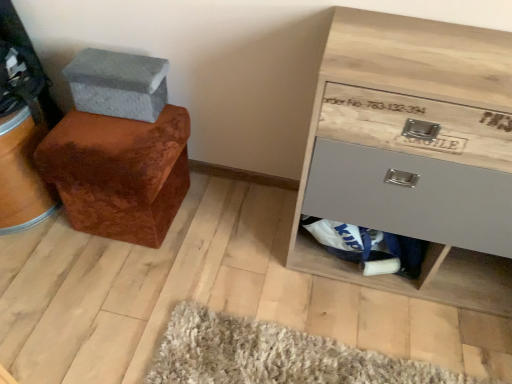
Locate an element on the screen. free area in between velvet brown ottoman at left and matte gray drawer at lower right is located at coordinates (238, 233).